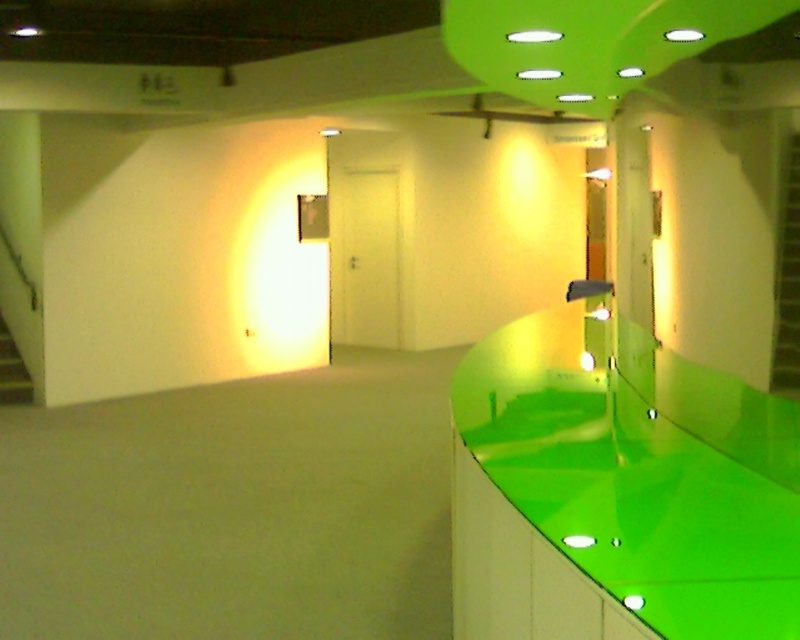
Is green glossy stairwell at right above wooden staircase at lower left?

Yes, green glossy stairwell at right is above wooden staircase at lower left.

Who is higher up, green glossy stairwell at right or wooden staircase at lower left?

green glossy stairwell at right is above.

This screenshot has height=640, width=800. What do you see at coordinates (786, 273) in the screenshot?
I see `green glossy stairwell at right` at bounding box center [786, 273].

Locate an element on the screen. Image resolution: width=800 pixels, height=640 pixels. green glossy stairwell at right is located at coordinates (786, 273).

Looking at this image, which is above, glossy green countertop at right or green glossy stairwell at right?

green glossy stairwell at right is above.

The width and height of the screenshot is (800, 640). Identify the location of glossy green countertop at right. (617, 492).

Find the location of a particular element. Image resolution: width=800 pixels, height=640 pixels. glossy green countertop at right is located at coordinates (617, 492).

The image size is (800, 640). In order to click on glossy green countertop at right in this screenshot , I will do `click(617, 492)`.

Between glossy green countertop at right and wooden staircase at lower left, which one appears on the right side from the viewer's perspective?

glossy green countertop at right is more to the right.

Image resolution: width=800 pixels, height=640 pixels. Describe the element at coordinates (617, 492) in the screenshot. I see `glossy green countertop at right` at that location.

The image size is (800, 640). I want to click on glossy green countertop at right, so click(x=617, y=492).